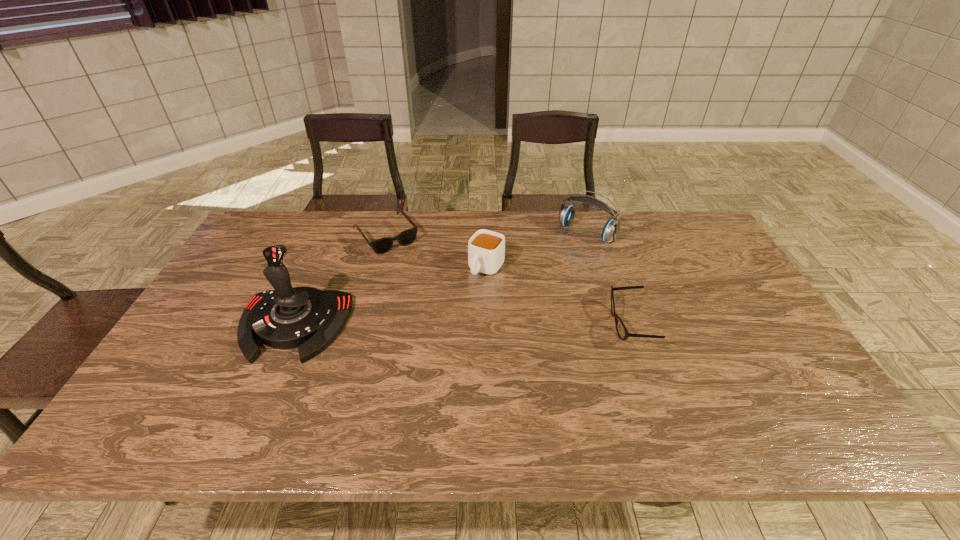
Where is `vacant area situated at the front lenses of the sunglasses`? Image resolution: width=960 pixels, height=540 pixels. vacant area situated at the front lenses of the sunglasses is located at coordinates (438, 301).

Find the location of a particular element. free space located 0.370m at the front lenses of the sunglasses is located at coordinates (458, 325).

You are a GUI agent. You are given a task and a screenshot of the screen. Output one action in this format:
    pyautogui.click(x=<x>, y=<y>)
    Task: Click on the free spot located 0.110m at the front lenses of the sunglasses
    The height and width of the screenshot is (540, 960).
    Given the screenshot: What is the action you would take?
    pyautogui.click(x=415, y=272)

I want to click on free point located 0.380m on the ear cups of the headset, so click(x=512, y=310).

The image size is (960, 540). I want to click on vacant space located on the ear cups of the headset, so click(524, 296).

This screenshot has width=960, height=540. I want to click on vacant space located on the ear cups of the headset, so click(564, 253).

In order to click on free region located 0.090m on the side with the handle of the third tallest object in this screenshot , I will do `click(465, 302)`.

The width and height of the screenshot is (960, 540). Identify the location of vacant area located 0.080m on the side with the handle of the third tallest object. click(x=466, y=300).

I want to click on vacant space situated 0.220m on the side with the handle of the third tallest object, so click(442, 332).

The image size is (960, 540). Identify the location of sunglasses situated at the far edge. (380, 246).